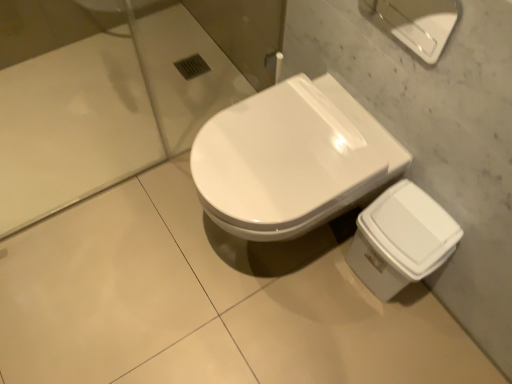
Find the location of `vacant point above white glossy trash can at lower right, which is the 2th porcelain in front-to-back order (from a real-world perspective)`. vacant point above white glossy trash can at lower right, which is the 2th porcelain in front-to-back order (from a real-world perspective) is located at coordinates (422, 210).